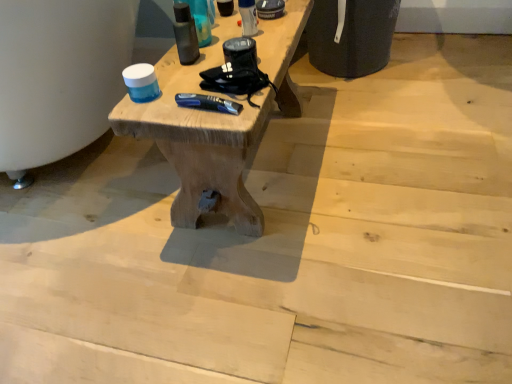
The image size is (512, 384). Identify the location of unoccupied area in front of wooden table at center. 276,286.